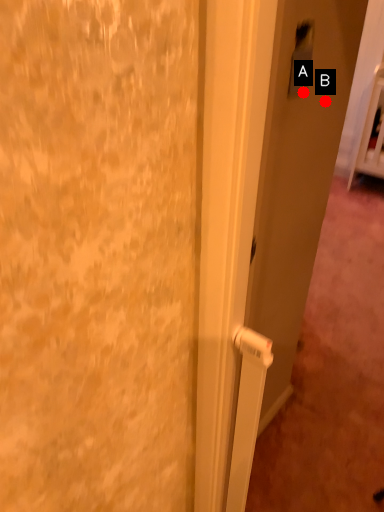
Question: Two points are circled on the image, labeled by A and B beside each circle. Which of the following is the farthest from the observer?

Choices:
 (A) A is further
 (B) B is further

Answer: (B)